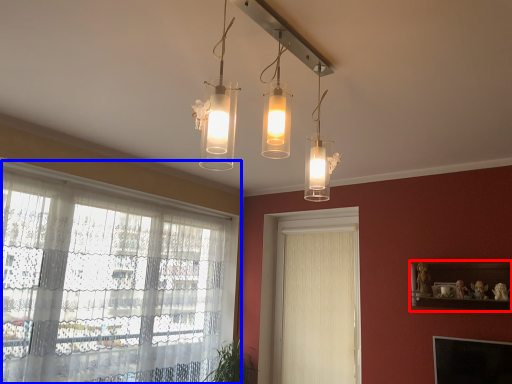
Question: Which point is further to the camera, shelf (highlighted by a red box) or window (highlighted by a blue box)?

Choices:
 (A) shelf
 (B) window

Answer: (A)